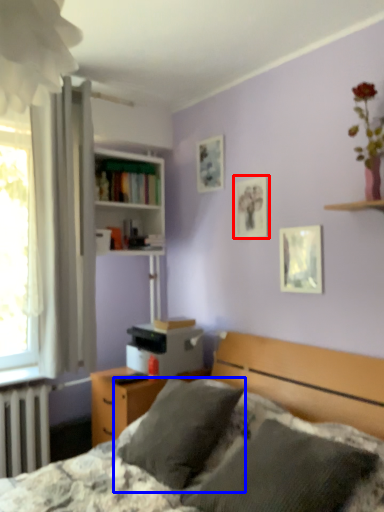
Question: Among these objects, which one is farthest to the camera, picture frame (highlighted by a red box) or pillow (highlighted by a blue box)?

Choices:
 (A) picture frame
 (B) pillow

Answer: (A)